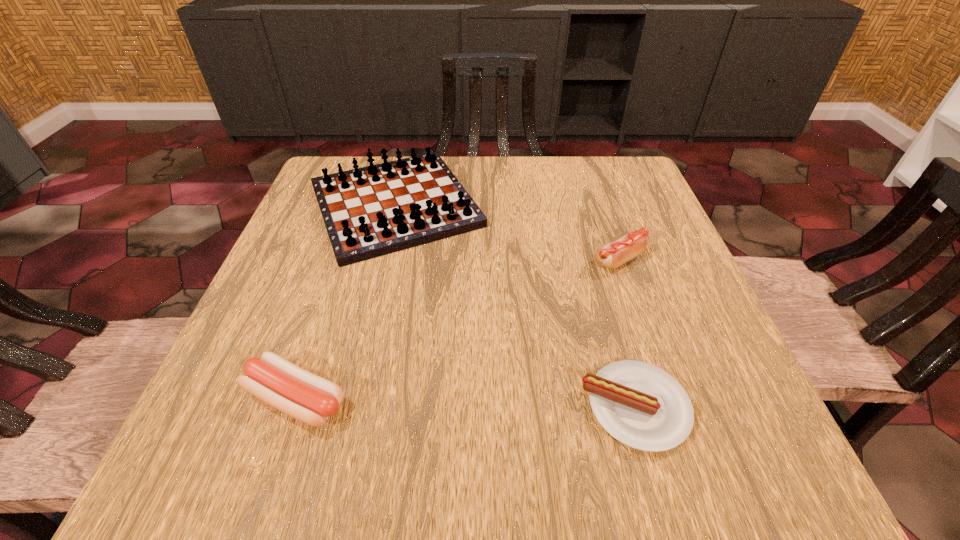
The height and width of the screenshot is (540, 960). What are the coordinates of `blank region between the leftmost sausage and the chessboard` in the screenshot? It's located at (346, 302).

You are a GUI agent. You are given a task and a screenshot of the screen. Output one action in this format:
    pyautogui.click(x=<x>, y=<y>)
    Task: Click on the vacant space in between the farthest sausage and the shortest sausage
    This screenshot has height=540, width=960.
    Given the screenshot: What is the action you would take?
    pyautogui.click(x=628, y=334)

I want to click on blank region between the shortest object and the leftmost sausage, so click(x=466, y=403).

Find the location of a particular element. This screenshot has height=540, width=960. free space that is in between the farthest sausage and the chessboard is located at coordinates (508, 233).

The image size is (960, 540). What are the coordinates of `blank region between the farthest sausage and the tallest object` in the screenshot? It's located at (508, 233).

This screenshot has width=960, height=540. Find the location of `empty location between the farthest sausage and the shortest sausage`. empty location between the farthest sausage and the shortest sausage is located at coordinates (628, 334).

At what (x,y) coordinates should I click in order to perform the action: click on free area in between the shortest object and the chessboard. Please return your answer as a coordinate pair (x, y). Image resolution: width=960 pixels, height=540 pixels. Looking at the image, I should click on (516, 306).

This screenshot has width=960, height=540. Identify the location of vacant region between the tallest object and the shortest sausage. (516, 306).

Identify the location of free space between the leftmost sausage and the farthest sausage. This screenshot has width=960, height=540. (458, 329).

You are a GUI agent. You are given a task and a screenshot of the screen. Output one action in this format:
    pyautogui.click(x=<x>, y=<y>)
    Task: Click on the object that is the second closest to the farthest sausage
    
    Given the screenshot: What is the action you would take?
    pyautogui.click(x=371, y=211)